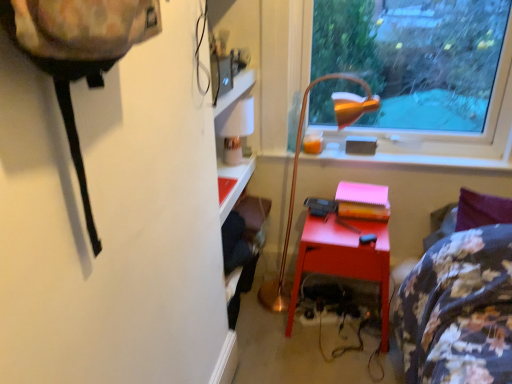
Locate an element on the screen. The width and height of the screenshot is (512, 384). free location above matte orange lampshade at upper center (from a real-world perspective) is located at coordinates (372, 152).